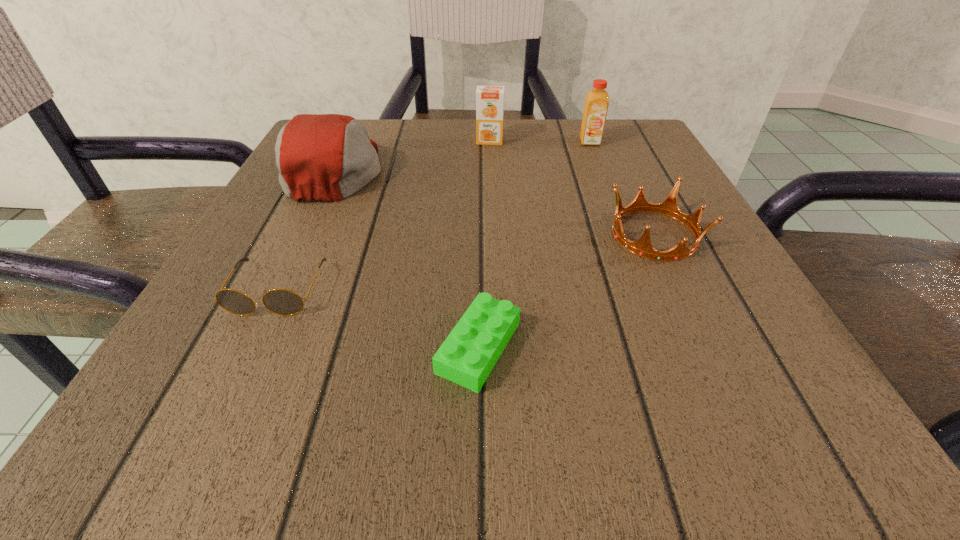
Where is `vacant space situated 0.200m on the front of the third shortest object`? vacant space situated 0.200m on the front of the third shortest object is located at coordinates (723, 381).

Identify the location of free space located on the lenses of the fifth tallest object. Image resolution: width=960 pixels, height=540 pixels. (228, 393).

Identify the location of blank space located on the left of the Lego. (378, 347).

Where is `cap that is at the far edge`? This screenshot has height=540, width=960. cap that is at the far edge is located at coordinates (328, 157).

The height and width of the screenshot is (540, 960). Identify the location of object located at the near edge. (x=467, y=356).

What are the coordinates of `cap located in the left edge section of the desktop` in the screenshot? It's located at (328, 157).

I want to click on sunglasses present at the left edge, so click(283, 302).

The width and height of the screenshot is (960, 540). What are the coordinates of `orange juice that is positioned at the right edge` in the screenshot? It's located at (597, 100).

The image size is (960, 540). I want to click on crown located in the right edge section of the desktop, so click(669, 207).

Locate an element on the screen. This screenshot has height=540, width=960. object situated at the far left corner is located at coordinates (328, 157).